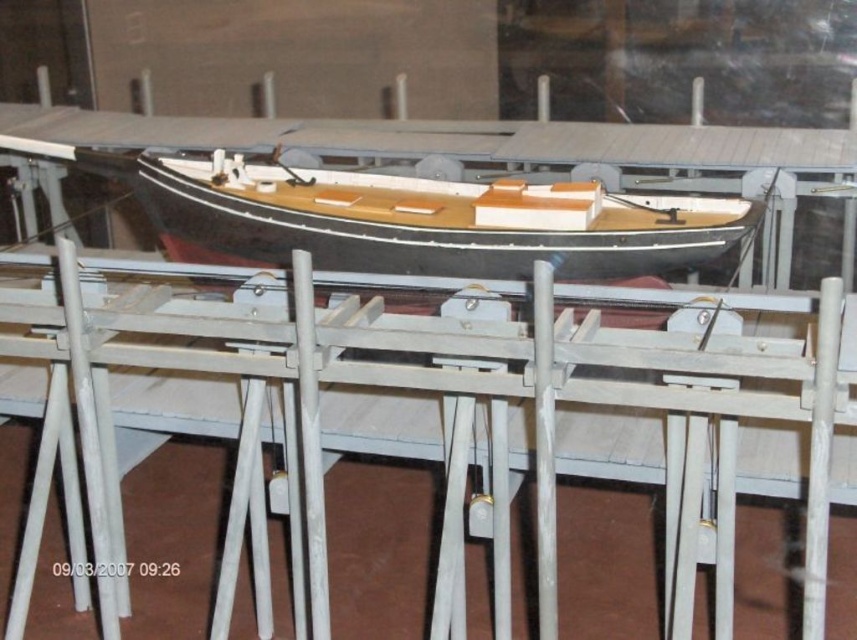
From the picture: Can you confirm if white matte rail at center is taller than wooden boat at center?

Indeed, white matte rail at center has a greater height compared to wooden boat at center.

Locate an element on the screen. This screenshot has width=857, height=640. white matte rail at center is located at coordinates (403, 388).